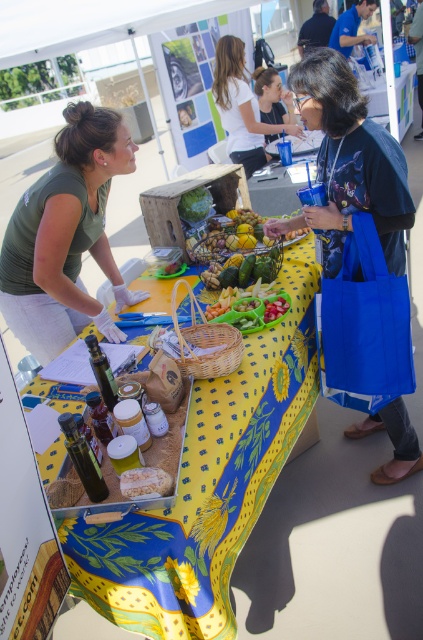
Question: Is yellow printed fabric at center to the right of green matte shirt at upper left from the viewer's perspective?

Choices:
 (A) no
 (B) yes

Answer: (B)

Question: Can you confirm if white cotton shirt at upper center is positioned above smooth plastic tray at center?

Choices:
 (A) yes
 (B) no

Answer: (A)

Question: Among these points, which one is farthest from the camera?

Choices:
 (A) (181, 209)
 (B) (24, 193)
 (C) (145, 490)
 (D) (255, 108)

Answer: (D)

Question: Which point is closer to the camera?

Choices:
 (A) dark blue fabric bag at center
 (B) smooth plastic tray at center
 (C) green matte shirt at upper left

Answer: (A)

Question: Is yellow printed fabric at center bigger than dark blue fabric bag at center?

Choices:
 (A) yes
 (B) no

Answer: (A)

Question: Which of the following is the closest to the observer?

Choices:
 (A) green matte shirt at upper left
 (B) green leafy vegetable at center
 (C) smooth plastic tray at center
 (D) crumbly brown bread at center

Answer: (D)